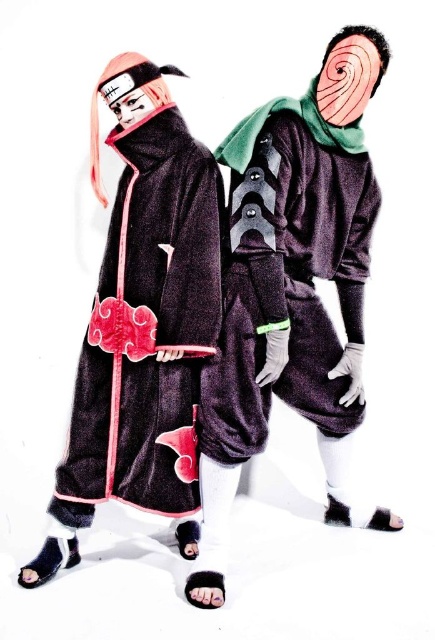
Can you confirm if velvet-like black robe at left is wider than velvet-like dark purple robe at center?

In fact, velvet-like black robe at left might be narrower than velvet-like dark purple robe at center.

Who is taller, velvet-like black robe at left or velvet-like dark purple robe at center?

velvet-like black robe at left

The image size is (435, 640). What are the coordinates of `velvet-like black robe at left` in the screenshot? It's located at (147, 330).